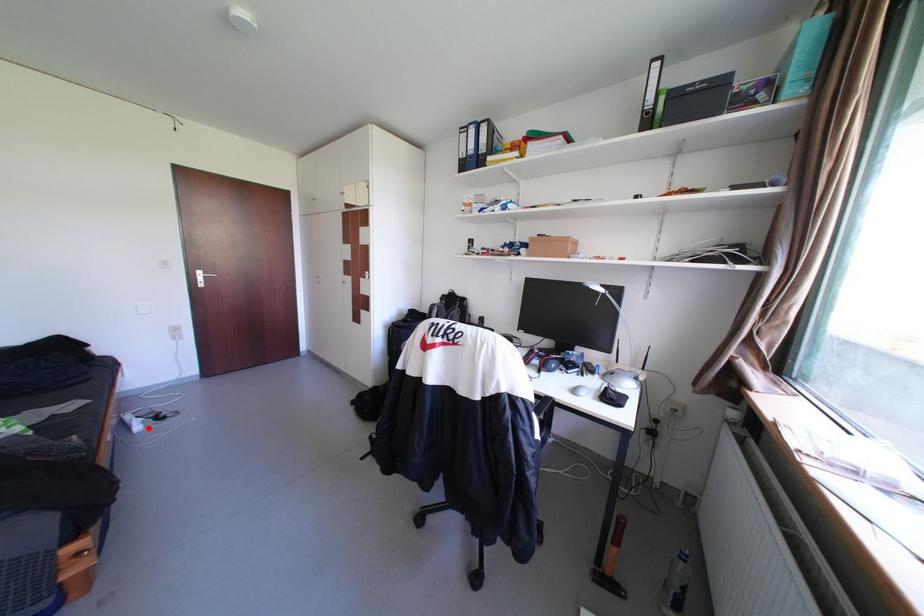
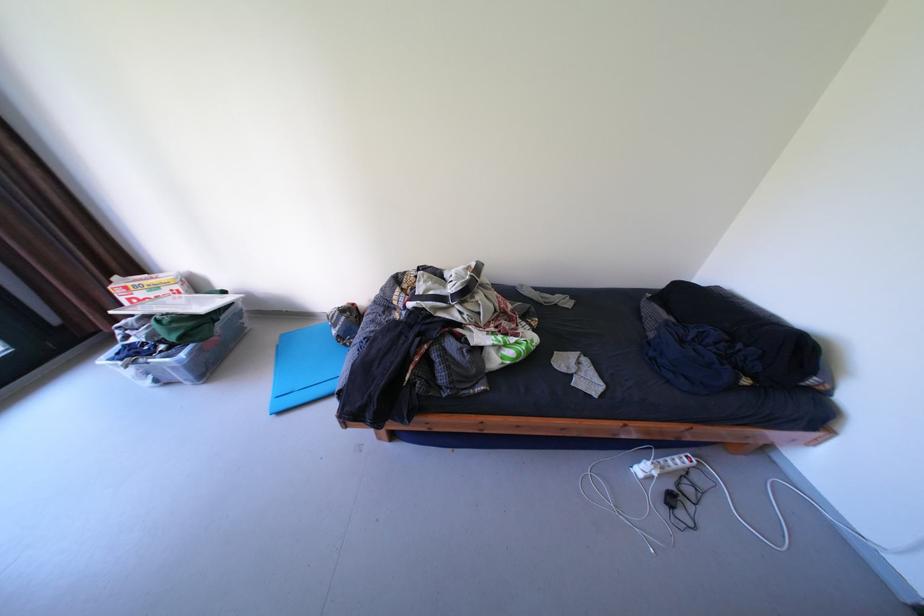
Question: I am providing you with two images of the same scene from different viewpoints. In image1, a red point is highlighted. Considering the same 3D point in image2, which of the following is correct?

Choices:
 (A) It is closer
 (B) It is farther

Answer: (A)